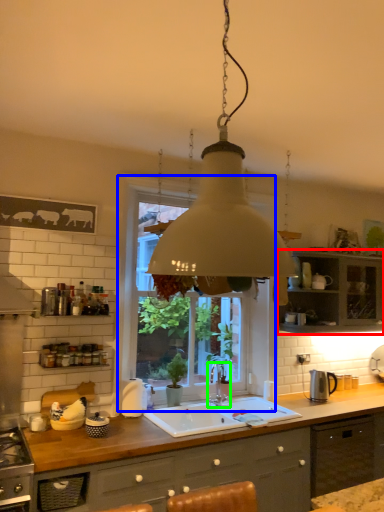
Question: Which is nearer to the cabinetry (highlighted by a red box)? window (highlighted by a blue box) or tap (highlighted by a green box).

Choices:
 (A) window
 (B) tap

Answer: (A)